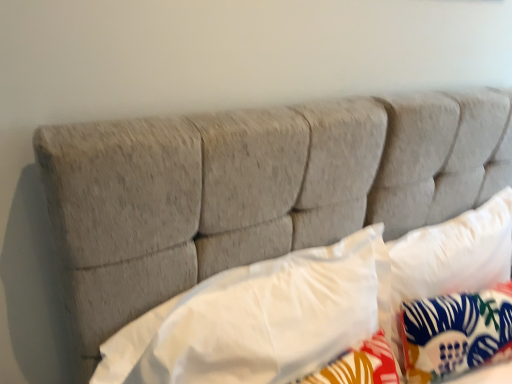
Question: Considering the relative sizes of white soft pillow at center, which is the 3th pillow in right-to-left order, and blue floral fabric pillow at center, which is counted as the 1th pillow, starting from the right, in the image provided, is white soft pillow at center, which is the 3th pillow in right-to-left order, wider than blue floral fabric pillow at center, which is counted as the 1th pillow, starting from the right,?

Choices:
 (A) no
 (B) yes

Answer: (B)

Question: Does white soft pillow at center, which is the 3th pillow in right-to-left order, have a lesser height compared to blue floral fabric pillow at center, which is counted as the 1th pillow, starting from the right?

Choices:
 (A) no
 (B) yes

Answer: (A)

Question: Is the position of white soft pillow at center, which is the 3th pillow in right-to-left order, less distant than that of blue floral fabric pillow at center, which is counted as the 1th pillow, starting from the right?

Choices:
 (A) no
 (B) yes

Answer: (B)

Question: From a real-world perspective, is white soft pillow at center, which is counted as the 1th pillow, starting from the left, physically below blue floral fabric pillow at center, which ranks as the 3th pillow in left-to-right order?

Choices:
 (A) yes
 (B) no

Answer: (B)

Question: Is white soft pillow at center, which is counted as the 1th pillow, starting from the left, not inside blue floral fabric pillow at center, which ranks as the 3th pillow in left-to-right order?

Choices:
 (A) no
 (B) yes

Answer: (B)

Question: Is white soft pillow at center, which is the 3th pillow in right-to-left order, oriented away from blue floral fabric pillow at center, which ranks as the 3th pillow in left-to-right order?

Choices:
 (A) yes
 (B) no

Answer: (B)

Question: Does blue floral fabric pillow at center, which is counted as the 1th pillow, starting from the right, contain white soft pillow at center, which is the 3th pillow in right-to-left order?

Choices:
 (A) yes
 (B) no

Answer: (B)

Question: Can you confirm if blue floral fabric pillow at center, which ranks as the 3th pillow in left-to-right order, is wider than white soft pillow at center, which is the 3th pillow in right-to-left order?

Choices:
 (A) yes
 (B) no

Answer: (B)

Question: From a real-world perspective, does blue floral fabric pillow at center, which is counted as the 1th pillow, starting from the right, sit lower than white soft pillow at center, which is counted as the 1th pillow, starting from the left?

Choices:
 (A) no
 (B) yes

Answer: (B)

Question: Are blue floral fabric pillow at center, which ranks as the 3th pillow in left-to-right order, and white soft pillow at center, which is counted as the 1th pillow, starting from the left, located far from each other?

Choices:
 (A) yes
 (B) no

Answer: (B)

Question: Considering the relative positions of blue floral fabric pillow at center, which ranks as the 3th pillow in left-to-right order, and white soft pillow at center, which is the 3th pillow in right-to-left order, in the image provided, is blue floral fabric pillow at center, which ranks as the 3th pillow in left-to-right order, to the left of white soft pillow at center, which is the 3th pillow in right-to-left order, from the viewer's perspective?

Choices:
 (A) no
 (B) yes

Answer: (A)

Question: Considering the relative sizes of blue floral fabric pillow at center, which ranks as the 3th pillow in left-to-right order, and white soft pillow at center, which is counted as the 1th pillow, starting from the left, in the image provided, is blue floral fabric pillow at center, which ranks as the 3th pillow in left-to-right order, taller than white soft pillow at center, which is counted as the 1th pillow, starting from the left,?

Choices:
 (A) no
 (B) yes

Answer: (A)

Question: Considering the relative sizes of blue floral fabric pillow at center, which ranks as the 3th pillow in left-to-right order, and white fabric pillow at center, arranged as the second pillow when viewed from the right, in the image provided, is blue floral fabric pillow at center, which ranks as the 3th pillow in left-to-right order, bigger than white fabric pillow at center, arranged as the second pillow when viewed from the right,?

Choices:
 (A) yes
 (B) no

Answer: (B)